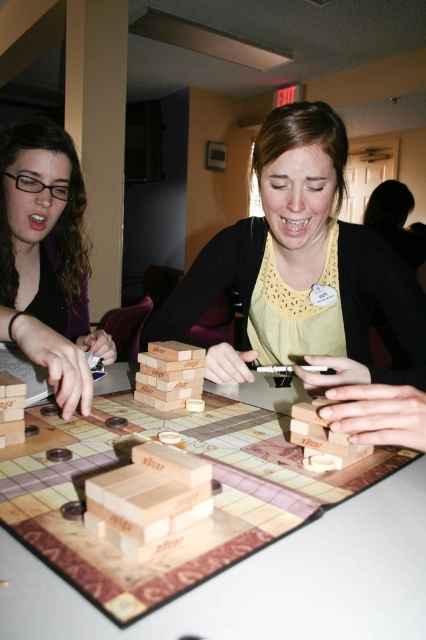
You are designing a display case for the matte wood blocks at center and the matte black hair at left. Which object should be placed at the back of the case to ensure both are fully visible?

The matte wood blocks at center should be placed at the back of the case since they are shorter than the matte black hair at left, allowing both to be fully visible.

You are a robot with a 12 inch wide arm. You need to reach the matte wood blocks at center from the matte black hair at left. Can your arm fit through the space between them?

The distance between the matte wood blocks at center and matte black hair at left is 14.22 inches. Since your arm is 12 inches wide, it can fit through the space as 12 is less than 14.22.